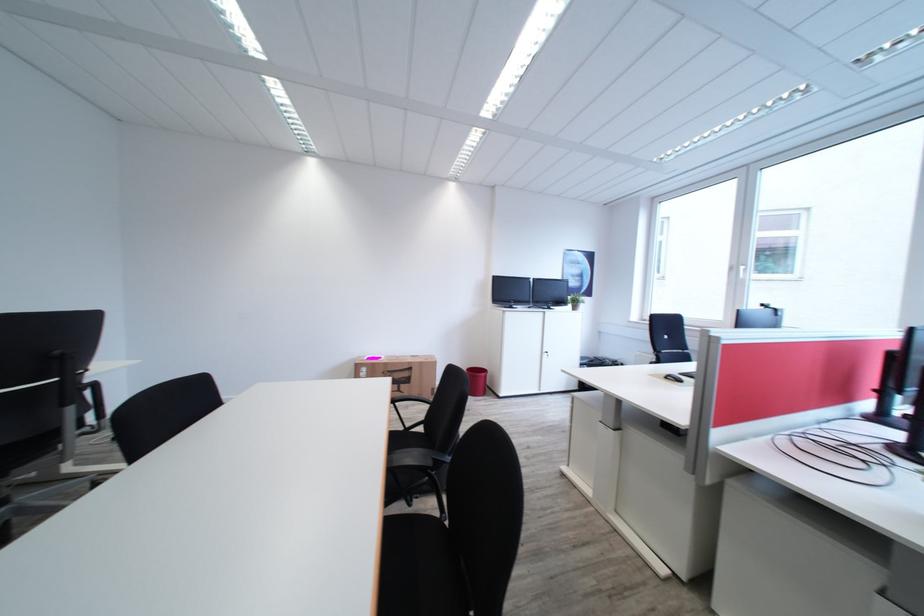
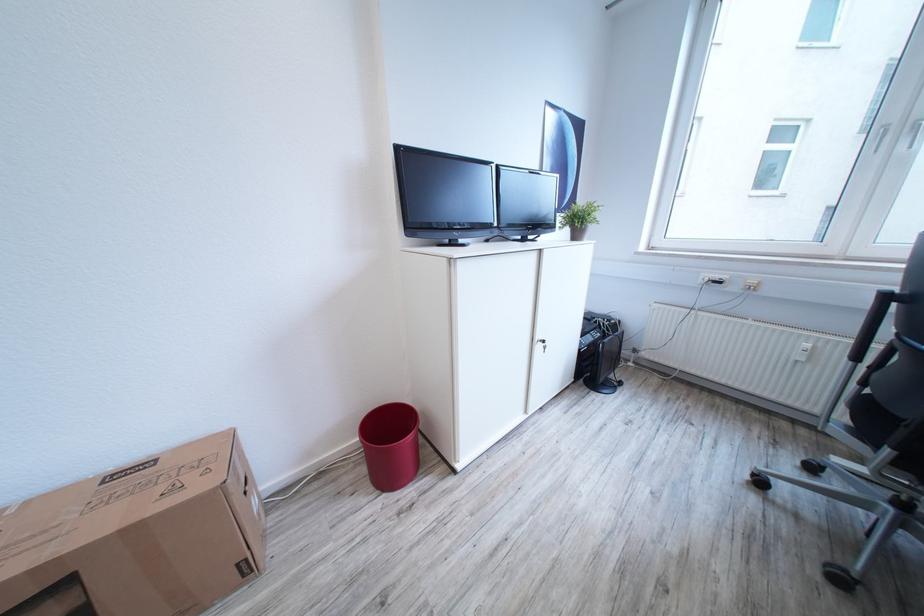
Find the pixel in the second image that matches point 623,363 in the first image.

(619, 323)